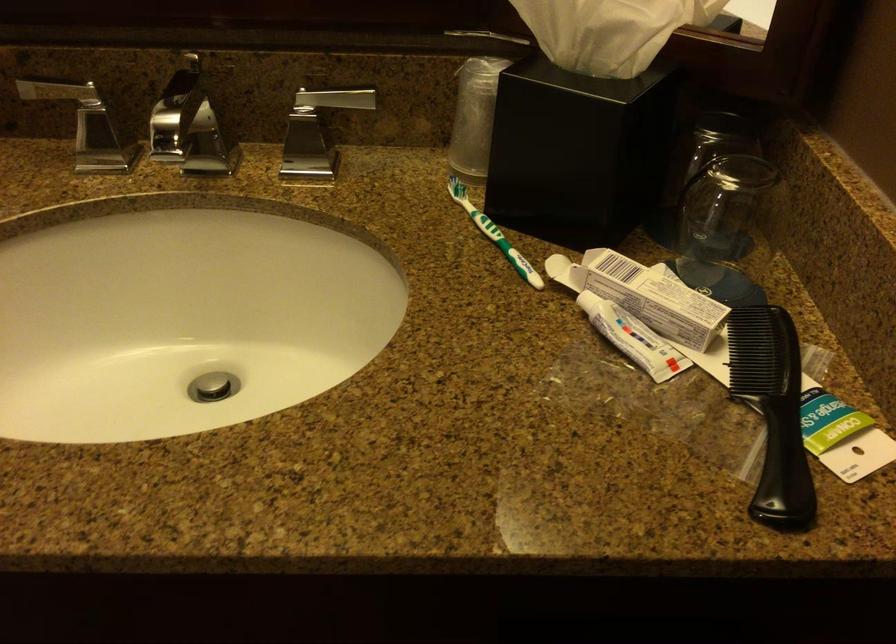
Locate an element on the screen. This screenshot has width=896, height=644. green and white toothbrush is located at coordinates (494, 234).